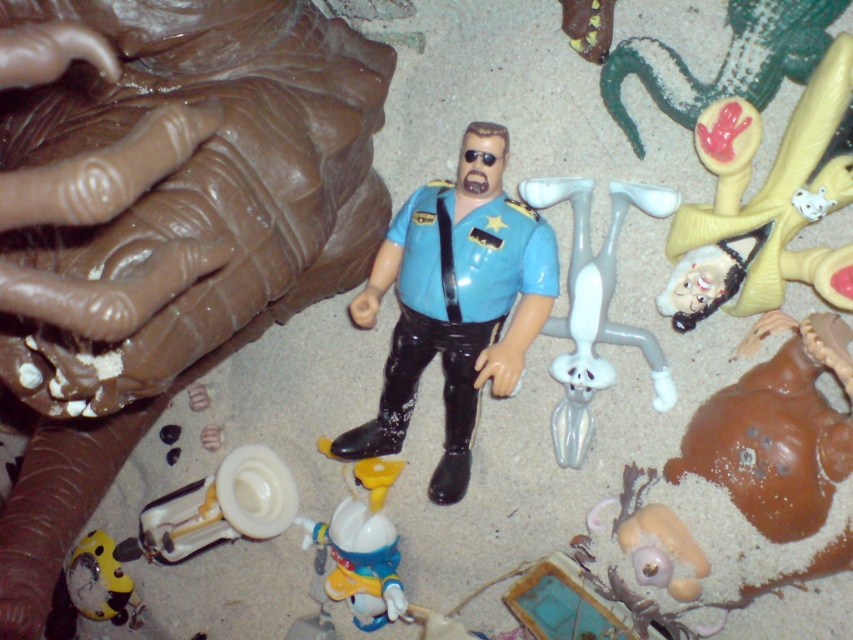
Can you confirm if blue glossy uniform at center is shorter than yellow matte clock at lower left?

No.

Who is more distant from viewer, (450,396) or (128,586)?

Positioned behind is point (128,586).

At what (x,y) coordinates should I click in order to perform the action: click on blue glossy uniform at center. Please return your answer as a coordinate pair (x, y). This screenshot has height=640, width=853. Looking at the image, I should click on (456, 301).

Who is taller, white matte rabbit at center or shiny blue plastic toy at lower center?

white matte rabbit at center is taller.

Based on the photo, which of these two, white matte rabbit at center or shiny blue plastic toy at lower center, stands shorter?

Standing shorter between the two is shiny blue plastic toy at lower center.

At what (x,y) coordinates should I click in order to perform the action: click on white matte rabbit at center. Please return your answer as a coordinate pair (x, y). This screenshot has height=640, width=853. Looking at the image, I should click on (595, 308).

Identify the location of white matte rabbit at center. (595, 308).

Who is positioned more to the right, yellow rubber figure at upper right or yellow matte clock at lower left?

yellow rubber figure at upper right is more to the right.

Is yellow rubber figure at upper right taller than yellow matte clock at lower left?

Yes.

Does point (788, 253) come behind point (97, 596)?

No, (788, 253) is closer to viewer.

At what (x,y) coordinates should I click in order to perform the action: click on yellow rubber figure at upper right. Please return your answer as a coordinate pair (x, y). The width and height of the screenshot is (853, 640). Looking at the image, I should click on (778, 188).